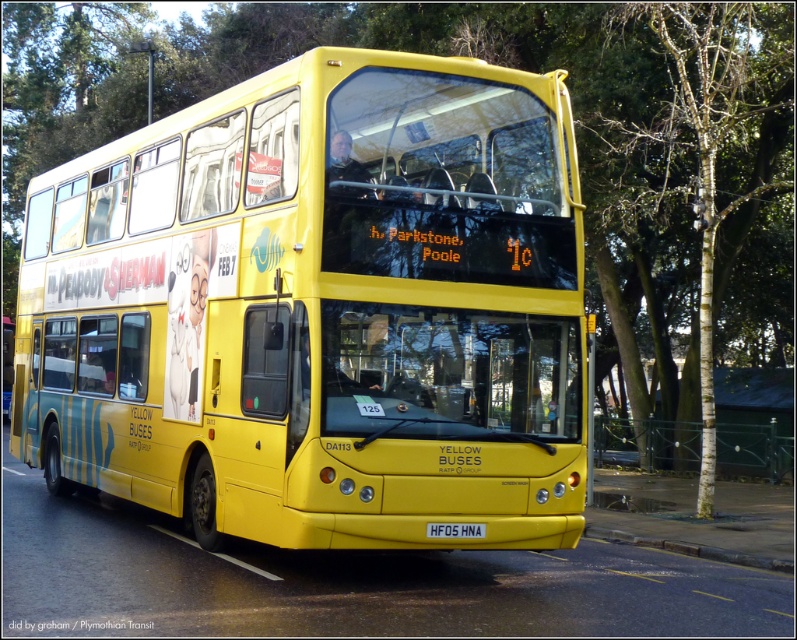
Between point (28, 369) and point (461, 525), which one is positioned behind?

Point (28, 369)

The image size is (797, 640). Find the location of `yellow matte/deck bus at center`. yellow matte/deck bus at center is located at coordinates (320, 308).

Where is `yellow matte/deck bus at center`? yellow matte/deck bus at center is located at coordinates (320, 308).

Does concrete at lower right have a lesser width compared to yellow plastic license plate at center?

In fact, concrete at lower right might be wider than yellow plastic license plate at center.

Between concrete at lower right and yellow plastic license plate at center, which one is positioned lower?

Positioned lower is concrete at lower right.

Image resolution: width=797 pixels, height=640 pixels. Describe the element at coordinates (689, 548) in the screenshot. I see `concrete at lower right` at that location.

In order to click on concrete at lower right in this screenshot , I will do `click(689, 548)`.

Between point (146, 320) and point (633, 532), which one is positioned behind?

The point (633, 532) is more distant.

Is point (560, 141) farther from camera compared to point (772, 561)?

That is False.

Where is `yellow matte/deck bus at center`? This screenshot has height=640, width=797. yellow matte/deck bus at center is located at coordinates (320, 308).